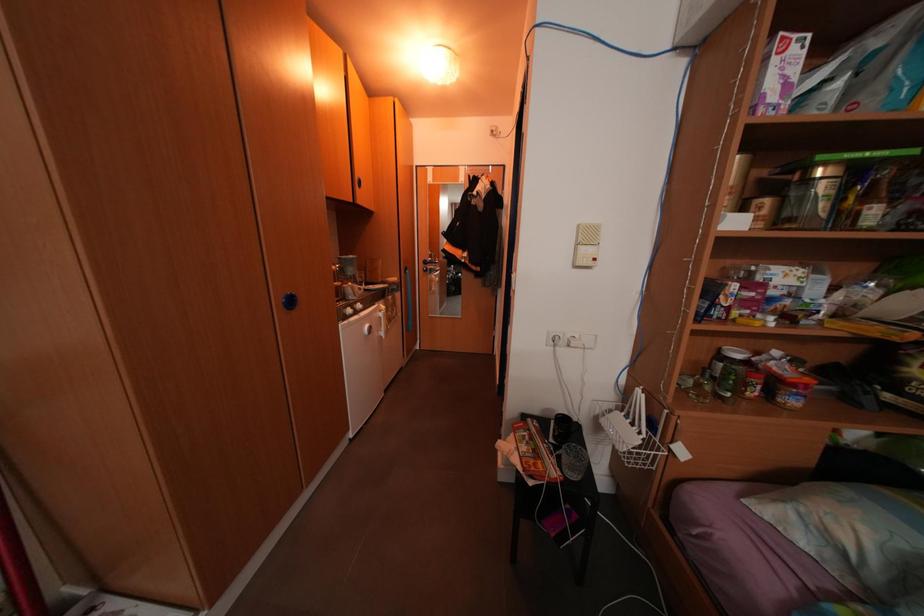
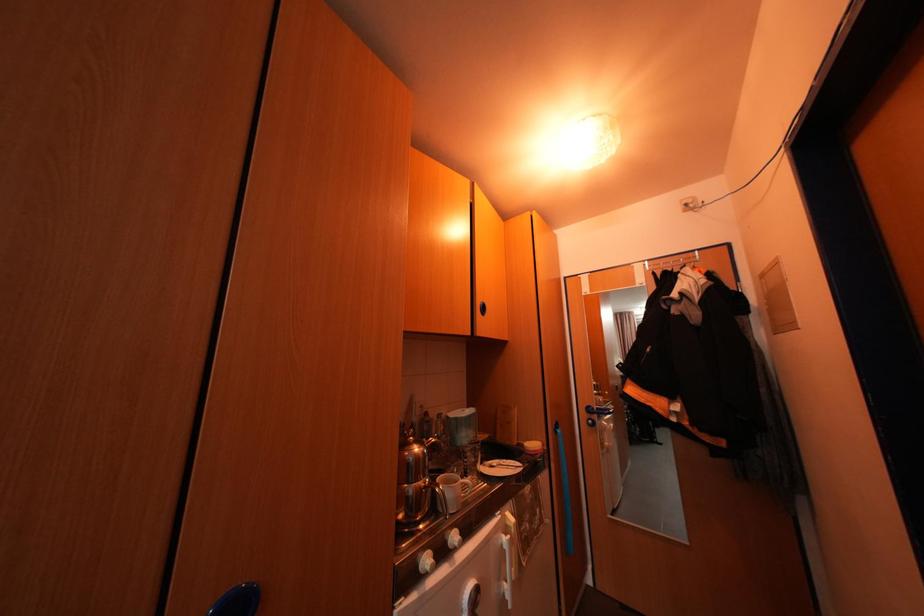
Based on the continuous images, in which direction is the camera rotating?

The camera rotated toward left-up.